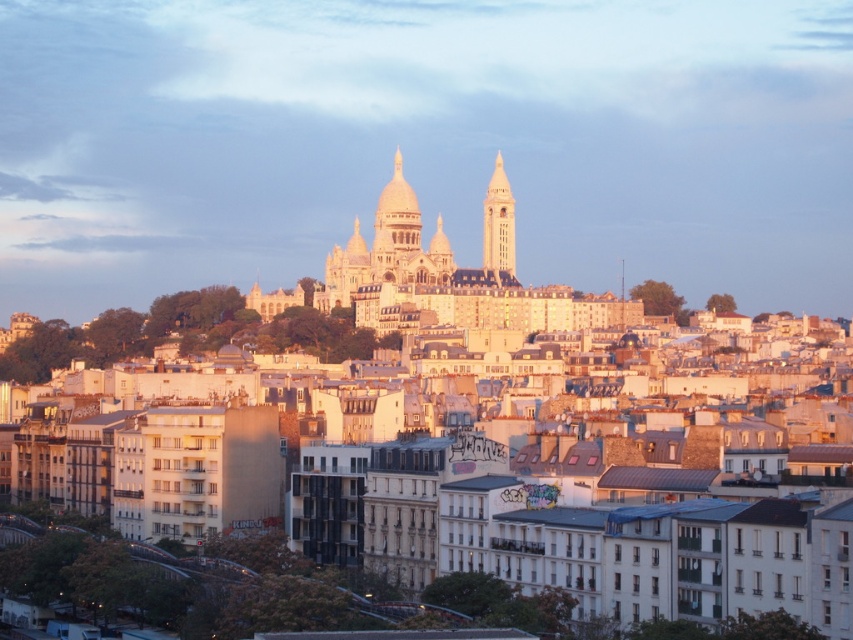
Question: Does white stone dome at center appear on the left side of white stone tower at upper center?

Choices:
 (A) no
 (B) yes

Answer: (B)

Question: Does white stone dome at center appear on the right side of white stone tower at upper center?

Choices:
 (A) no
 (B) yes

Answer: (A)

Question: Which point is closer to the camera?

Choices:
 (A) white stone tower at upper center
 (B) white stone dome at center

Answer: (B)

Question: Which of the following is the farthest from the observer?

Choices:
 (A) (503, 216)
 (B) (413, 230)

Answer: (A)

Question: Does white stone dome at center appear over white stone tower at upper center?

Choices:
 (A) yes
 (B) no

Answer: (A)

Question: Which point is farther to the camera?

Choices:
 (A) (383, 195)
 (B) (500, 177)

Answer: (B)